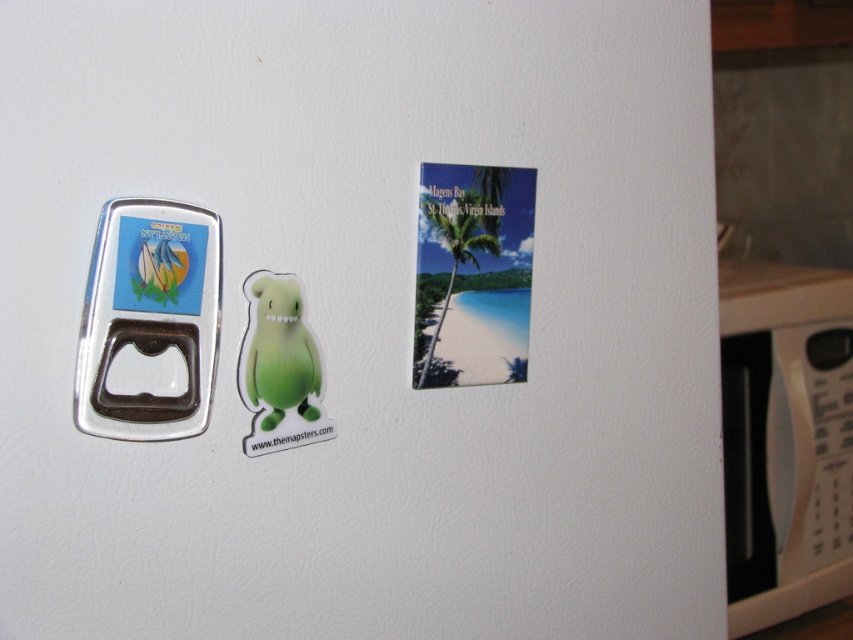
Question: Which of the following is the closest to the observer?

Choices:
 (A) white plastic microwave at right
 (B) green rubber toy at center
 (C) metallic silver bottle opener at left

Answer: (C)

Question: Which point is closer to the camera taking this photo?

Choices:
 (A) (119, 227)
 (B) (755, 451)

Answer: (A)

Question: Can you confirm if white plastic microwave at right is bigger than green rubber toy at center?

Choices:
 (A) no
 (B) yes

Answer: (B)

Question: Can you confirm if metallic silver bottle opener at left is positioned below green rubber toy at center?

Choices:
 (A) yes
 (B) no

Answer: (B)

Question: Which object appears farthest from the camera in this image?

Choices:
 (A) metallic silver bottle opener at left
 (B) green rubber toy at center

Answer: (B)

Question: Where is white plastic microwave at right located in relation to metallic silver bottle opener at left in the image?

Choices:
 (A) left
 (B) right

Answer: (B)